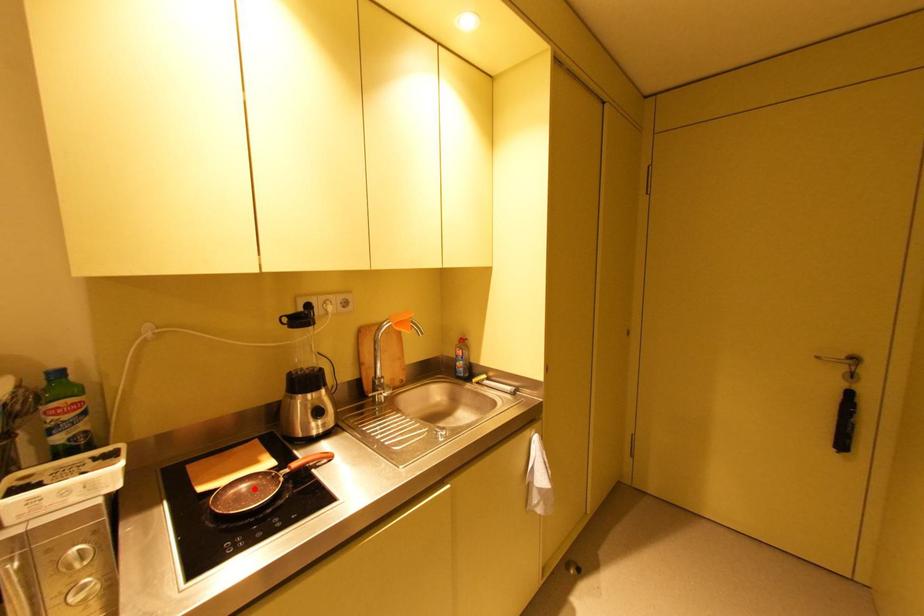
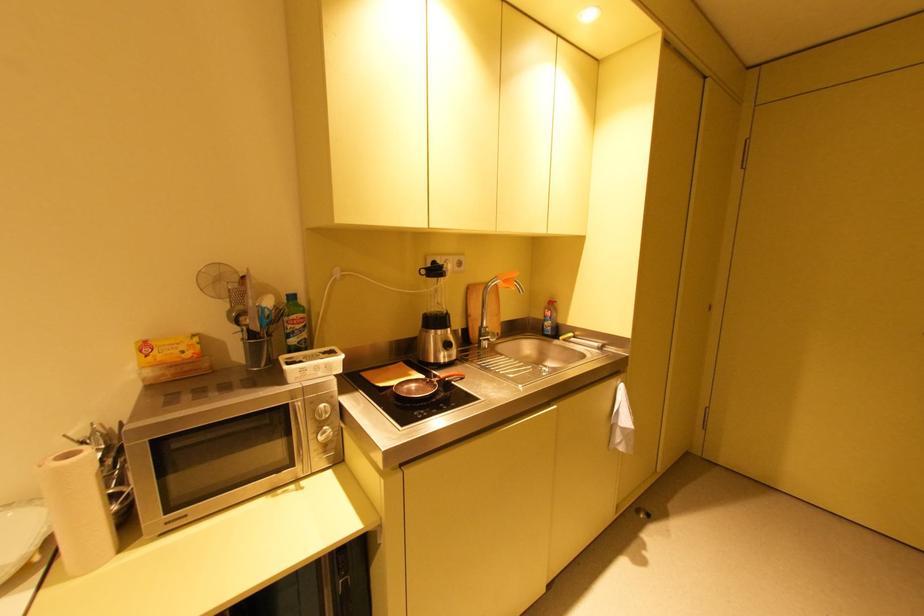
The point at the highlighted location is marked in the first image. Where is the corresponding point in the second image?

(420, 387)